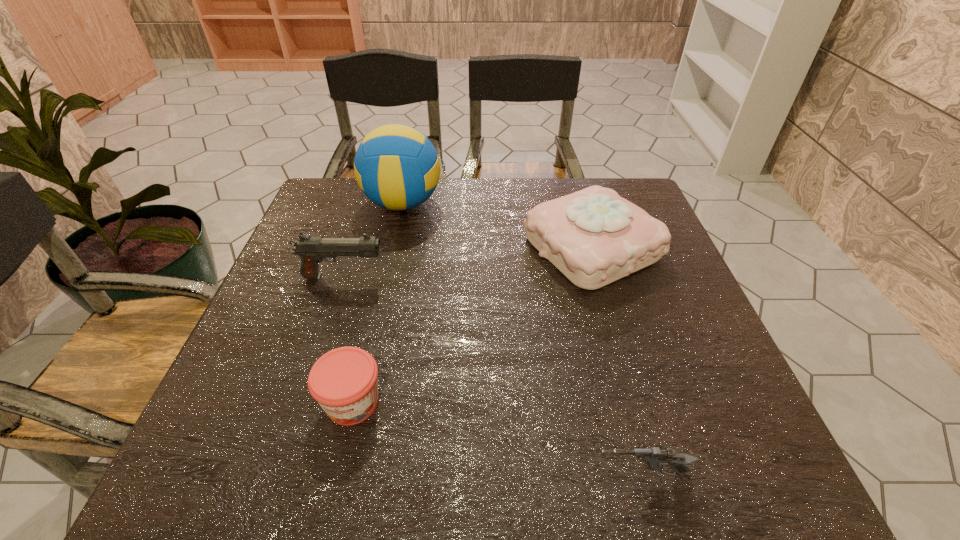
You are a GUI agent. You are given a task and a screenshot of the screen. Output one action in this format:
    pyautogui.click(x=<x>, y=<y>)
    Task: Click on the vacant position at the far right corner of the desktop
    
    Given the screenshot: What is the action you would take?
    tap(615, 178)

Locate an element on the screen. The image size is (960, 540). free area in between the nearest object and the volleyball is located at coordinates (521, 339).

This screenshot has height=540, width=960. Find the location of `empty space between the cake and the volleyball`. empty space between the cake and the volleyball is located at coordinates (497, 225).

Locate an element on the screen. free space that is in between the jam and the volleyball is located at coordinates click(377, 303).

Find the location of `vacant region between the shorter gun and the volleyball`. vacant region between the shorter gun and the volleyball is located at coordinates (521, 339).

The width and height of the screenshot is (960, 540). What are the coordinates of `vacant area that lies between the shortest object and the jam` in the screenshot? It's located at (496, 437).

The height and width of the screenshot is (540, 960). Identify the location of free space between the volleyball and the nearer gun. (521, 339).

The height and width of the screenshot is (540, 960). What are the coordinates of `vacant area between the right gun and the tallest object` in the screenshot? It's located at (521, 339).

The height and width of the screenshot is (540, 960). What are the coordinates of `empty location between the nearest object and the volleyball` in the screenshot? It's located at (521, 339).

Where is `free space between the second nearest object and the cake`? free space between the second nearest object and the cake is located at coordinates [472, 325].